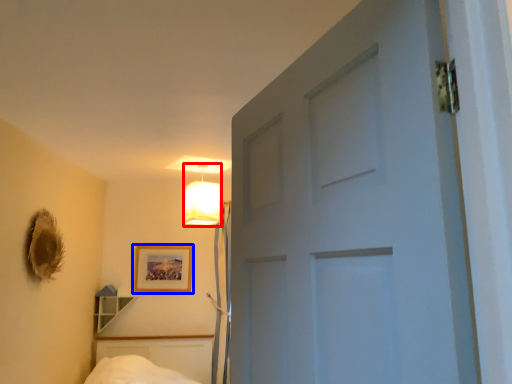
Question: Which point is further to the camera, lamp (highlighted by a red box) or picture frame (highlighted by a blue box)?

Choices:
 (A) lamp
 (B) picture frame

Answer: (B)